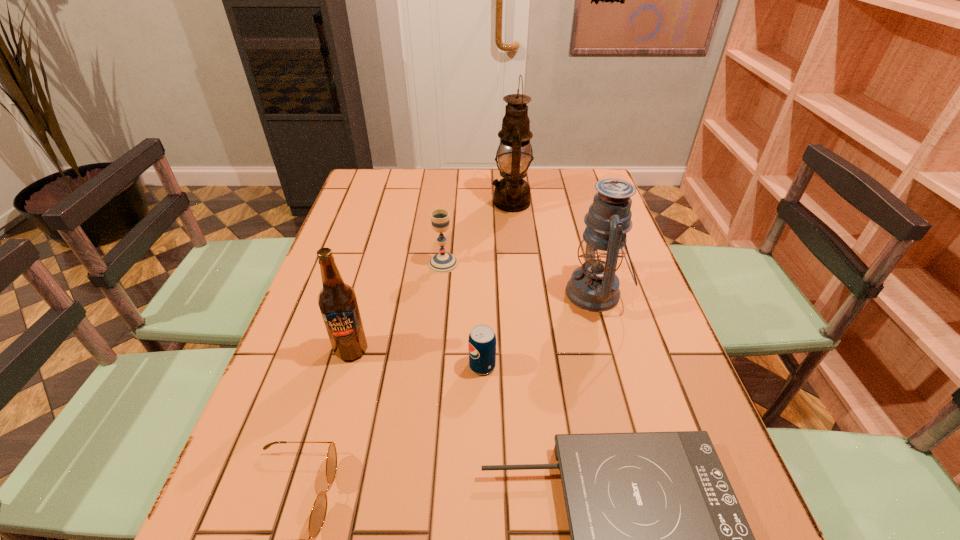
Identify the location of oil lamp. This screenshot has height=540, width=960. (512, 193).

Find the location of a particular element. The image size is (960, 540). the farthest object is located at coordinates (512, 193).

You are a GUI agent. You are given a task and a screenshot of the screen. Output one action in this format:
    pyautogui.click(x=<x>, y=<y>)
    Task: Click on the lantern
    Image resolution: width=960 pixels, height=540 pixels.
    Given the screenshot: What is the action you would take?
    pyautogui.click(x=594, y=286)

Locate an element on the screen. Image resolution: width=960 pixels, height=540 pixels. beer bottle is located at coordinates (337, 301).

In order to click on chalice in this screenshot , I will do `click(443, 262)`.

The image size is (960, 540). I want to click on the fourth tallest object, so click(443, 262).

I want to click on the third shortest object, so click(x=482, y=340).

Identify the location of vacant space located 0.120m on the back of the oil lamp. The image size is (960, 540). (508, 173).

What are the coordinates of `vacant space located 0.380m on the front-facing side of the lantern` in the screenshot? It's located at (421, 293).

The height and width of the screenshot is (540, 960). Find the location of `vacant space located on the front-facing side of the lantern`. vacant space located on the front-facing side of the lantern is located at coordinates (505, 293).